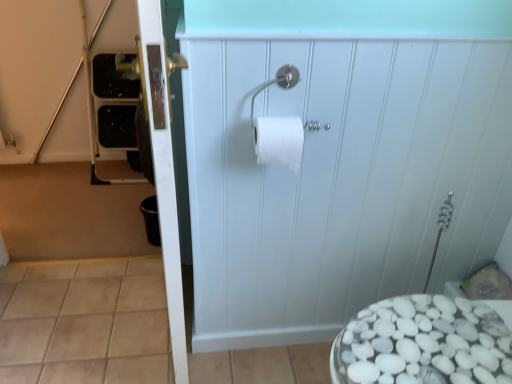
Question: Is white matte cabinet at center, which is counted as the first screen door, starting from the right, situated inside white matte toilet paper at center or outside?

Choices:
 (A) outside
 (B) inside

Answer: (A)

Question: In terms of width, does white matte cabinet at center, which is counted as the second screen door, starting from the left, look wider or thinner when compared to white matte toilet paper at center?

Choices:
 (A) wide
 (B) thin

Answer: (B)

Question: Considering the real-world distances, which object is closest to the white matte toilet paper at center?

Choices:
 (A) white matte cabinet at center, which is counted as the second screen door, starting from the left
 (B) silver metallic toilet paper holder at upper center
 (C) white glossy door at left, the 2th screen door in the right-to-left sequence

Answer: (B)

Question: Which is farther from the silver metallic toilet paper holder at upper center?

Choices:
 (A) white matte cabinet at center, which is counted as the second screen door, starting from the left
 (B) white matte toilet paper at center
 (C) white glossy door at left, acting as the first screen door starting from the left

Answer: (A)